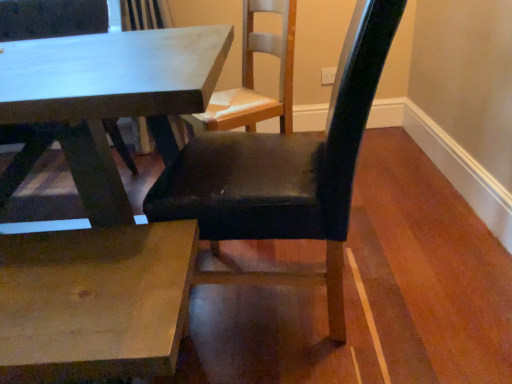
This screenshot has height=384, width=512. Identify the location of vacant area on top of smooth white table at center (from a real-world perspective). (90, 59).